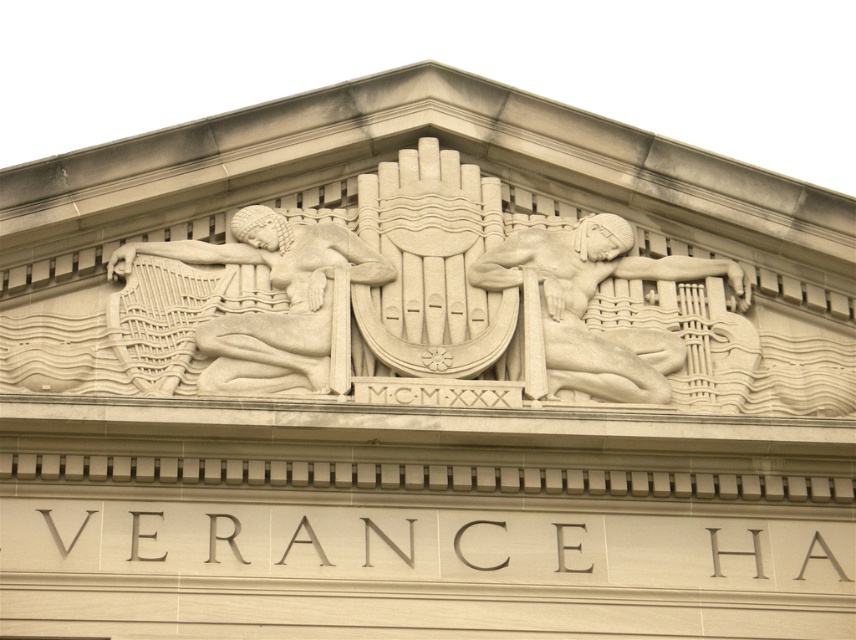
You are an architect examining the building facade and need to place a new decorative element. The existing white stone harp at center is positioned at coordinates approximately 0.487 on the x and 0.324 on the y. If you want to place a new element 0.1 units to the right and 0.05 units above the harp, what would be the new coordinates?

The new coordinates would be approximately x 0.587 and y 0.374, calculated by adding 0.1 to the x and 0.05 to the y of the white stone harp at center.